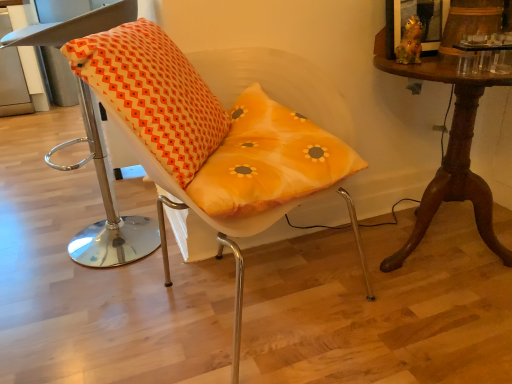
Question: Is orange fabric cushion at left, which is the first chair from left to right, shorter than translucent orange cushion at center, the second chair when ordered from left to right?

Choices:
 (A) no
 (B) yes

Answer: (A)

Question: From the image's perspective, is orange fabric cushion at left, which is the first chair from left to right, on translucent orange cushion at center, the first chair in the right-to-left sequence?

Choices:
 (A) yes
 (B) no

Answer: (A)

Question: Is orange fabric cushion at left, which is the first chair from left to right, positioned in front of translucent orange cushion at center, the second chair when ordered from left to right?

Choices:
 (A) yes
 (B) no

Answer: (B)

Question: Is orange fabric cushion at left, the second chair viewed from the right, to the left of translucent orange cushion at center, the second chair when ordered from left to right, from the viewer's perspective?

Choices:
 (A) yes
 (B) no

Answer: (A)

Question: Is orange fabric cushion at left, the second chair viewed from the right, bigger than translucent orange cushion at center, the second chair when ordered from left to right?

Choices:
 (A) yes
 (B) no

Answer: (B)

Question: Does orange fabric cushion at left, which is the first chair from left to right, have a greater height compared to translucent orange cushion at center, the second chair when ordered from left to right?

Choices:
 (A) yes
 (B) no

Answer: (A)

Question: Could you tell me if orange printed cushion at left is turned towards orange fabric cushion at left, which is the first chair from left to right?

Choices:
 (A) no
 (B) yes

Answer: (A)

Question: Can you confirm if orange printed cushion at left is thinner than orange fabric cushion at left, which is the first chair from left to right?

Choices:
 (A) yes
 (B) no

Answer: (B)

Question: Does orange printed cushion at left have a greater width compared to orange fabric cushion at left, the second chair viewed from the right?

Choices:
 (A) yes
 (B) no

Answer: (A)

Question: From a real-world perspective, is orange printed cushion at left beneath orange fabric cushion at left, which is the first chair from left to right?

Choices:
 (A) yes
 (B) no

Answer: (B)

Question: Considering the relative positions of orange printed cushion at left and orange fabric cushion at left, the second chair viewed from the right, in the image provided, is orange printed cushion at left to the left of orange fabric cushion at left, the second chair viewed from the right, from the viewer's perspective?

Choices:
 (A) yes
 (B) no

Answer: (B)

Question: Is orange printed cushion at left looking in the opposite direction of orange fabric cushion at left, which is the first chair from left to right?

Choices:
 (A) no
 (B) yes

Answer: (A)

Question: From a real-world perspective, is mahogany wood table at right under translucent orange cushion at center, the second chair when ordered from left to right?

Choices:
 (A) no
 (B) yes

Answer: (B)